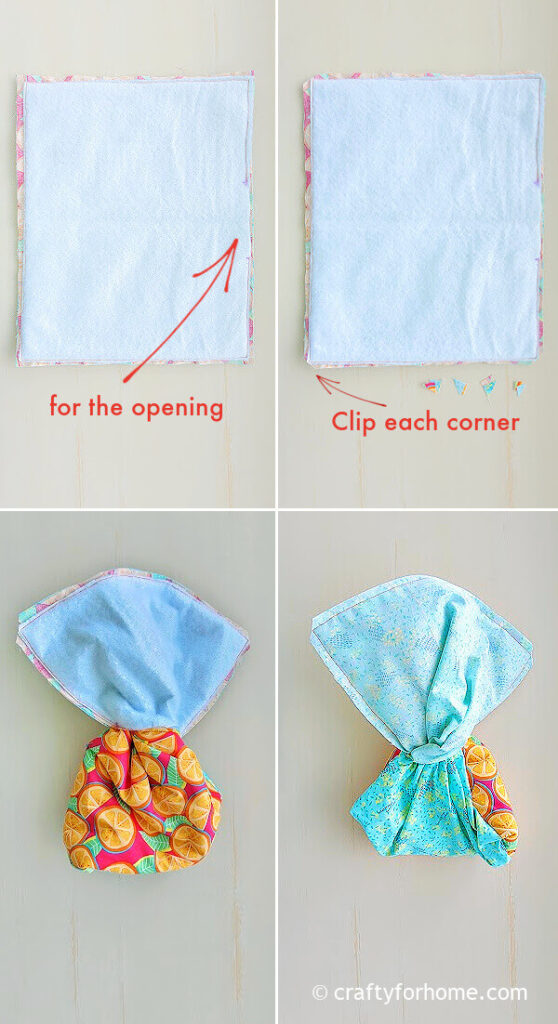
This screenshot has width=558, height=1024. I want to click on white surface of fabric, so click(119, 189), click(412, 204).